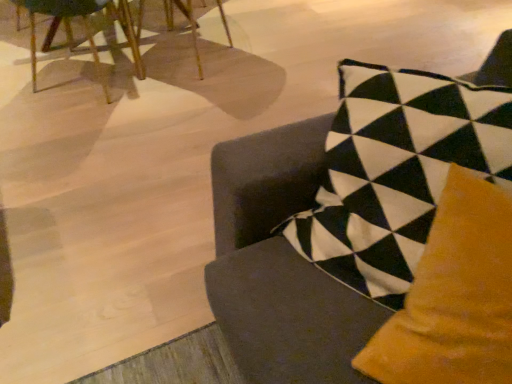
Question: Considering the relative positions of velvet cushion at center, marked as the first chair in a right-to-left arrangement, and wooden chair at upper left, positioned as the third chair in front-to-back order, in the image provided, is velvet cushion at center, marked as the first chair in a right-to-left arrangement, to the left or to the right of wooden chair at upper left, positioned as the third chair in front-to-back order,?

Choices:
 (A) right
 (B) left

Answer: (A)

Question: Is velvet cushion at center, marked as the first chair in a right-to-left arrangement, bigger or smaller than wooden chair at upper left, the 2th chair viewed from the right?

Choices:
 (A) small
 (B) big

Answer: (B)

Question: Which object is positioned farthest from the wooden chair at upper left, which is the third chair in right-to-left order?

Choices:
 (A) wooden chair at upper left, the 2th chair in the left-to-right sequence
 (B) velvet cushion at center, the third chair positioned from the left

Answer: (B)

Question: Which object is the farthest from the wooden chair at upper left, which is counted as the first chair, starting from the left?

Choices:
 (A) velvet cushion at center, which ranks as the 1th chair in front-to-back order
 (B) wooden chair at upper left, the 2th chair viewed from the right

Answer: (A)